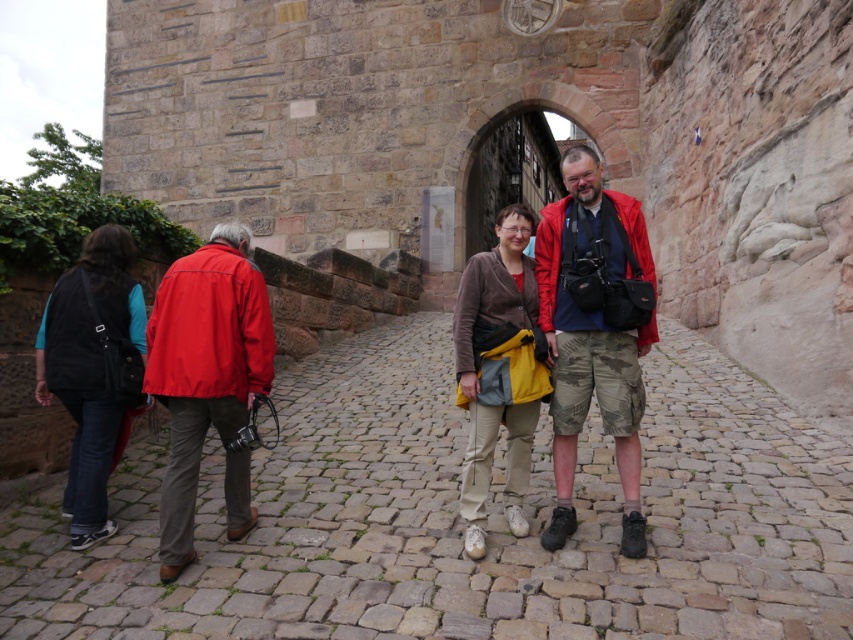
Describe the element at coordinates (204, 368) in the screenshot. This screenshot has width=853, height=640. I see `matte red jacket at left` at that location.

Is matte red jacket at left behind brown textured jacket at center?

No, matte red jacket at left is in front of brown textured jacket at center.

Does point (260, 353) come farther from viewer compared to point (538, 356)?

No, it is not.

Find the location of a particular element. The image size is (853, 640). matte red jacket at left is located at coordinates (204, 368).

Which of these two, camouflage shorts at center or matte red jacket at left, stands taller?

With more height is camouflage shorts at center.

Is camouflage shorts at center behind matte red jacket at left?

Yes.

Identify the location of camouflage shorts at center. The height and width of the screenshot is (640, 853). (592, 333).

At what (x,y) coordinates should I click in order to perform the action: click on camouflage shorts at center. Please return your answer as a coordinate pair (x, y). Looking at the image, I should click on (592, 333).

Is camouflage shorts at center further to camera compared to black fabric backpack at left?

No.

Looking at this image, can you confirm if camouflage shorts at center is positioned to the left of black fabric backpack at left?

No, camouflage shorts at center is not to the left of black fabric backpack at left.

Which is behind, point (640, 388) or point (99, 476)?

The point (640, 388) is behind.

Find the location of `camouflage shorts at center`. camouflage shorts at center is located at coordinates (592, 333).